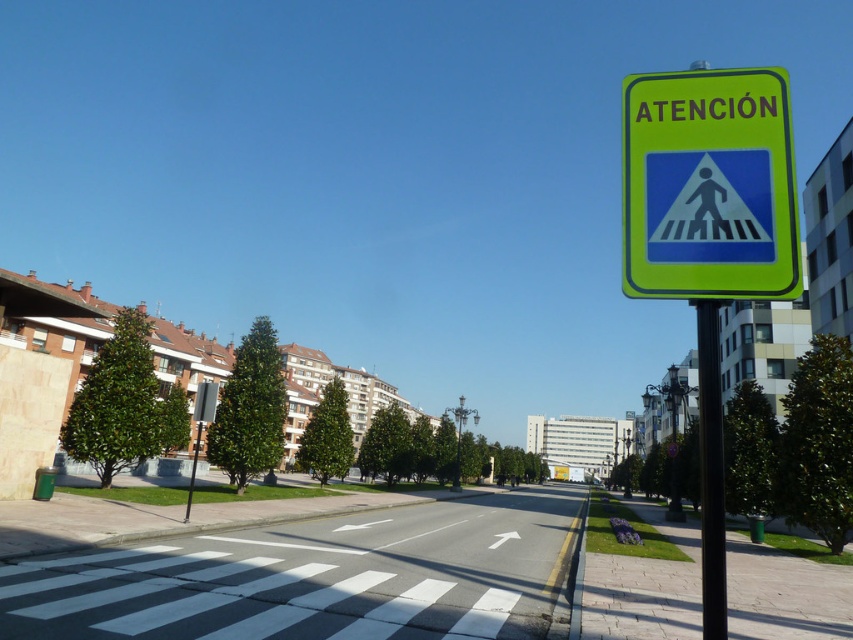
Can you confirm if yellow-green plastic pedestrian crossing sign at upper right is bigger than metallic parking sign at left?

No.

Does point (769, 195) come farther from viewer compared to point (190, 481)?

No, it is in front of (190, 481).

Where is `yellow-green plastic pedestrian crossing sign at upper right`? Image resolution: width=853 pixels, height=640 pixels. yellow-green plastic pedestrian crossing sign at upper right is located at coordinates (709, 186).

This screenshot has width=853, height=640. In order to click on yellow-green plastic pedestrian crossing sign at upper right in this screenshot , I will do click(709, 186).

Who is positioned more to the left, yellow-green plastic pedestrian crossing sign at upper right or metallic pole at right?

metallic pole at right

Where is `yellow-green plastic pedestrian crossing sign at upper right`? The image size is (853, 640). yellow-green plastic pedestrian crossing sign at upper right is located at coordinates (709, 186).

Is point (701, 355) farther from viewer compared to point (194, 404)?

No, (701, 355) is closer to viewer.

Is metallic pole at right bigger than metallic parking sign at left?

No.

Who is more forward, (721, 536) or (202, 417)?

Point (721, 536) is in front.

Find the location of a particular element. This screenshot has width=853, height=640. metallic pole at right is located at coordinates (711, 472).